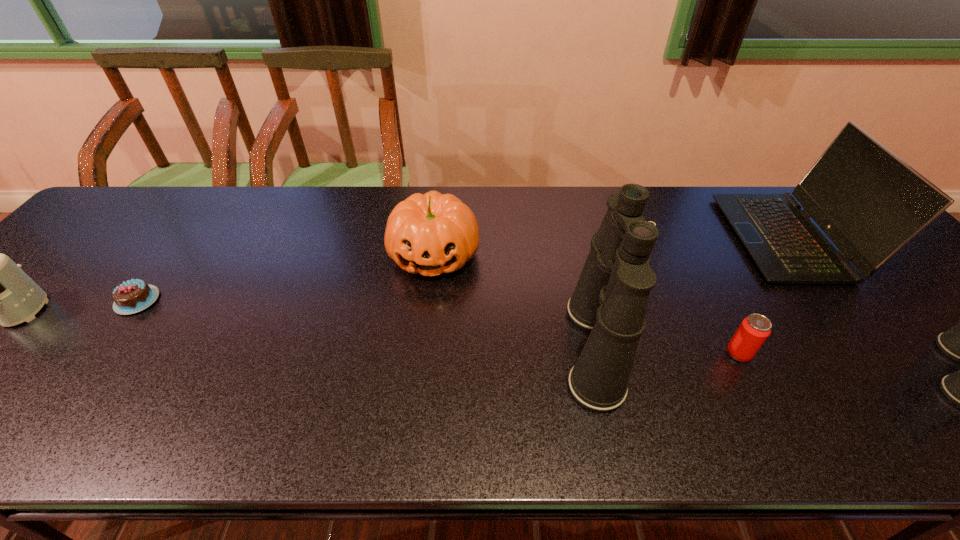
The height and width of the screenshot is (540, 960). What are the coordinates of `vacant area that lies between the shortest object and the taller binoculars` in the screenshot? It's located at (366, 325).

This screenshot has height=540, width=960. I want to click on free space between the tallest object and the beer can, so click(666, 351).

Where is `empty space that is in between the shortest object and the second shortest object`? This screenshot has height=540, width=960. empty space that is in between the shortest object and the second shortest object is located at coordinates (438, 327).

Locate which object is the sixth closest to the fifth object from left to right. Please provide its 2D coordinates. Your answer should be formatted as a tuple, i.e. [(x, y)], where the tuple contains the x and y coordinates of a point satisfying the conditions above.

[(0, 293)]

You are a GUI agent. You are given a task and a screenshot of the screen. Output one action in this format:
    pyautogui.click(x=<x>, y=<y>)
    Task: Click on the object that stands as the fourth closest to the fifth object from right to left
    
    Given the screenshot: What is the action you would take?
    pyautogui.click(x=870, y=203)

What are the coordinates of `free space that satisfies the following two spatial constraints: 1. on the carved face of the fifth tallest object; 2. on the right side of the tallest object` in the screenshot? It's located at (423, 348).

The width and height of the screenshot is (960, 540). Find the location of `vacant area that satisfies the following two spatial constraints: 1. on the carved face of the third object from left to right; 2. on the left side of the fourth object from left to right`. vacant area that satisfies the following two spatial constraints: 1. on the carved face of the third object from left to right; 2. on the left side of the fourth object from left to right is located at coordinates (423, 348).